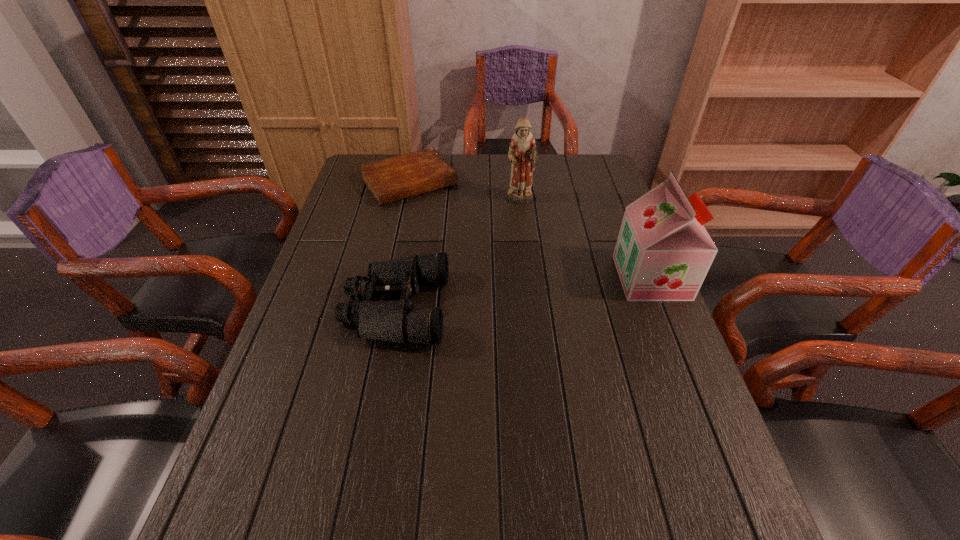
Identify the location of vacant space on the desktop that is between the second shortest object and the soya milk and is positioned on the front-facing side of the third object from left to right. Image resolution: width=960 pixels, height=540 pixels. (553, 289).

The image size is (960, 540). What are the coordinates of `free space on the desktop that is between the second shortest object and the soya milk and is positioned on the spine side of the shortest object` in the screenshot? It's located at (497, 296).